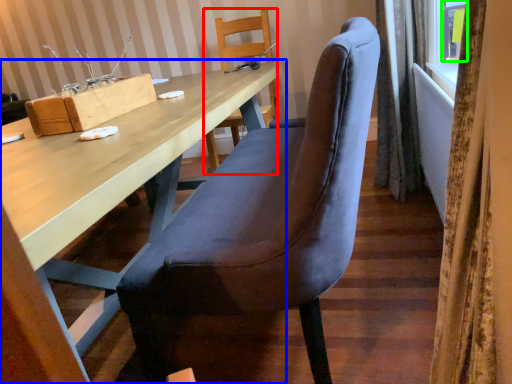
Question: Estimate the real-world distances between objects in this image. Which object is closer to chair (highlighted by a red box), desk (highlighted by a blue box) or window (highlighted by a green box)?

Choices:
 (A) desk
 (B) window

Answer: (A)